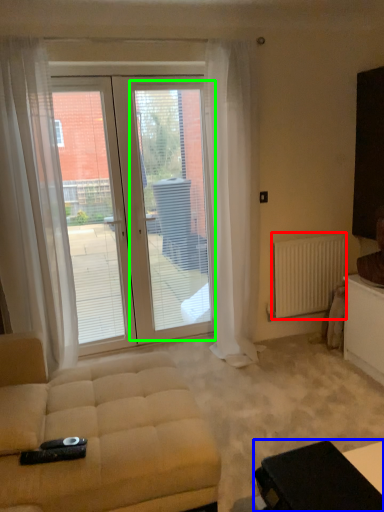
Question: Considering the real-world distances, which object is farthest from radiator (highlighted by a red box)? table (highlighted by a blue box) or screen door (highlighted by a green box)?

Choices:
 (A) table
 (B) screen door

Answer: (A)